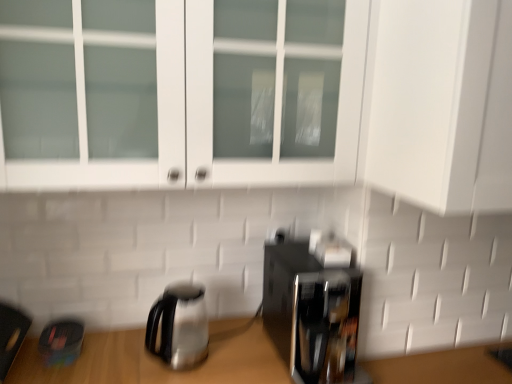
Question: Can we say stainless steel kettle at lower left lies outside black glossy coffee maker at lower right?

Choices:
 (A) no
 (B) yes

Answer: (B)

Question: Are stainless steel kettle at lower left and black glossy coffee maker at lower right making contact?

Choices:
 (A) no
 (B) yes

Answer: (A)

Question: Does stainless steel kettle at lower left have a lesser width compared to black glossy coffee maker at lower right?

Choices:
 (A) yes
 (B) no

Answer: (A)

Question: Is stainless steel kettle at lower left further to the viewer compared to black glossy coffee maker at lower right?

Choices:
 (A) no
 (B) yes

Answer: (B)

Question: Does stainless steel kettle at lower left have a greater height compared to black glossy coffee maker at lower right?

Choices:
 (A) no
 (B) yes

Answer: (A)

Question: From the image's perspective, relative to stainless steel kettle at lower left, is black glossy coffee maker at lower right above or below?

Choices:
 (A) below
 (B) above

Answer: (B)

Question: Considering the positions of black glossy coffee maker at lower right and stainless steel kettle at lower left in the image, is black glossy coffee maker at lower right taller or shorter than stainless steel kettle at lower left?

Choices:
 (A) short
 (B) tall

Answer: (B)

Question: Do you think black glossy coffee maker at lower right is within stainless steel kettle at lower left, or outside of it?

Choices:
 (A) inside
 (B) outside

Answer: (B)

Question: In the image, is black glossy coffee maker at lower right positioned in front of or behind stainless steel kettle at lower left?

Choices:
 (A) front
 (B) behind

Answer: (A)

Question: Is stainless steel kettle at lower left to the left or to the right of white glass cabinet at upper center in the image?

Choices:
 (A) left
 (B) right

Answer: (A)

Question: Looking at their shapes, would you say stainless steel kettle at lower left is wider or thinner than white glass cabinet at upper center?

Choices:
 (A) thin
 (B) wide

Answer: (A)

Question: Considering the positions of point (187, 301) and point (0, 52), is point (187, 301) closer or farther from the camera than point (0, 52)?

Choices:
 (A) farther
 (B) closer

Answer: (A)

Question: Is stainless steel kettle at lower left taller or shorter than white glass cabinet at upper center?

Choices:
 (A) tall
 (B) short

Answer: (B)

Question: From the image's perspective, is white glass cabinet at upper center above or below stainless steel kettle at lower left?

Choices:
 (A) below
 (B) above

Answer: (B)

Question: From a real-world perspective, relative to stainless steel kettle at lower left, is white glass cabinet at upper center vertically above or below?

Choices:
 (A) below
 (B) above

Answer: (B)